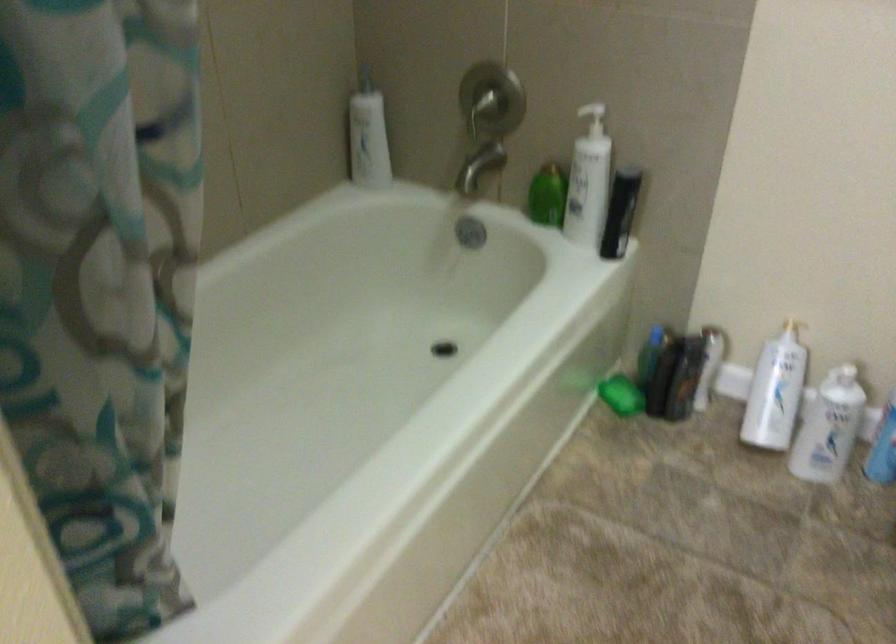
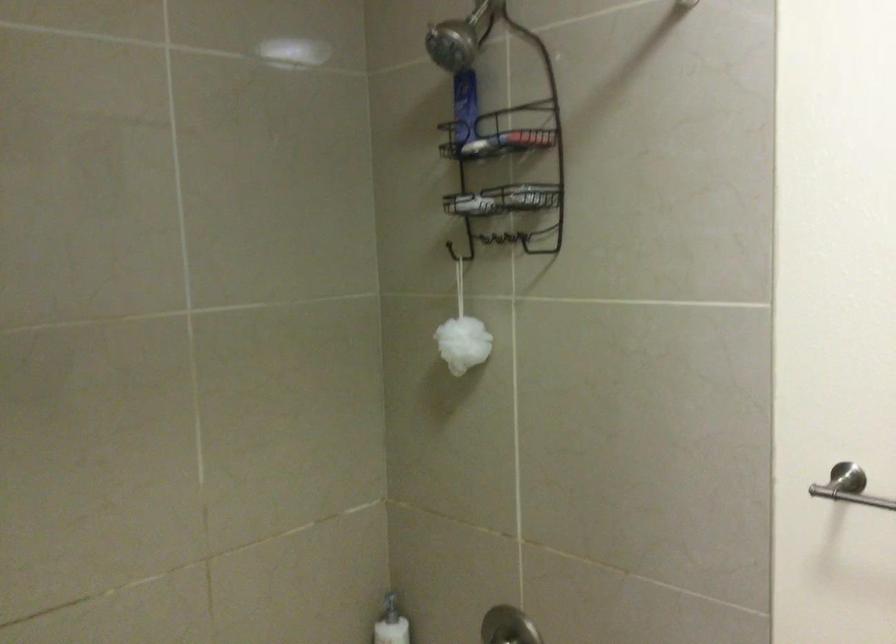
The point at (359, 90) is marked in the first image. Where is the corresponding point in the second image?

(389, 605)